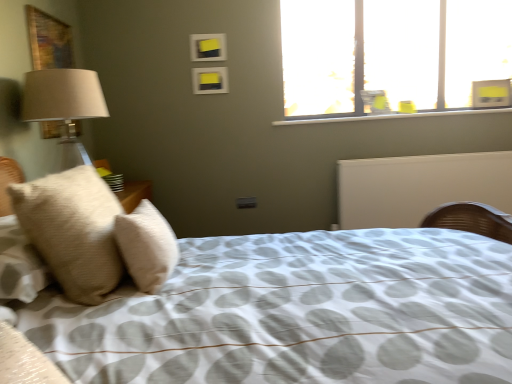
Question: Is yellow matte picture frame at upper center, which is the 2th picture frame in top-to-bottom order, next to white matte radiator at center?

Choices:
 (A) no
 (B) yes

Answer: (A)

Question: Is yellow matte picture frame at upper center, which is counted as the 1th picture frame, starting from the bottom, not inside white matte radiator at center?

Choices:
 (A) no
 (B) yes

Answer: (B)

Question: Does yellow matte picture frame at upper center, which is the 2th picture frame in top-to-bottom order, have a smaller size compared to white matte radiator at center?

Choices:
 (A) no
 (B) yes

Answer: (B)

Question: Is the depth of yellow matte picture frame at upper center, which is the 2th picture frame in top-to-bottom order, less than that of white matte radiator at center?

Choices:
 (A) no
 (B) yes

Answer: (B)

Question: From the image's perspective, would you say yellow matte picture frame at upper center, which is the 2th picture frame in top-to-bottom order, is shown under white matte radiator at center?

Choices:
 (A) no
 (B) yes

Answer: (A)

Question: Considering the positions of beige textured pillow at left, which is the 1th pillow from left to right, and transparent glass window at upper right in the image, is beige textured pillow at left, which is the 1th pillow from left to right, wider or thinner than transparent glass window at upper right?

Choices:
 (A) wide
 (B) thin

Answer: (A)

Question: Considering the positions of point (77, 276) and point (501, 67), is point (77, 276) closer or farther from the camera than point (501, 67)?

Choices:
 (A) farther
 (B) closer

Answer: (B)

Question: Considering the positions of beige textured pillow at left, which is the 1th pillow from left to right, and transparent glass window at upper right in the image, is beige textured pillow at left, which is the 1th pillow from left to right, taller or shorter than transparent glass window at upper right?

Choices:
 (A) short
 (B) tall

Answer: (A)

Question: From the image's perspective, relative to transparent glass window at upper right, is beige textured pillow at left, the 2th pillow positioned from the right, above or below?

Choices:
 (A) above
 (B) below

Answer: (B)

Question: Considering the positions of transparent glass window at upper right and white matte radiator at center in the image, is transparent glass window at upper right wider or thinner than white matte radiator at center?

Choices:
 (A) wide
 (B) thin

Answer: (B)

Question: Would you say transparent glass window at upper right is to the left or to the right of white matte radiator at center in the picture?

Choices:
 (A) right
 (B) left

Answer: (B)

Question: In terms of size, does transparent glass window at upper right appear bigger or smaller than white matte radiator at center?

Choices:
 (A) small
 (B) big

Answer: (A)

Question: Is transparent glass window at upper right inside the boundaries of white matte radiator at center, or outside?

Choices:
 (A) outside
 (B) inside

Answer: (A)

Question: Visually, is yellow matte picture frame at upper center, which is the 2th picture frame in top-to-bottom order, positioned to the left or to the right of transparent glass window at upper right?

Choices:
 (A) left
 (B) right

Answer: (A)

Question: Looking at their shapes, would you say yellow matte picture frame at upper center, which is counted as the 1th picture frame, starting from the bottom, is wider or thinner than transparent glass window at upper right?

Choices:
 (A) thin
 (B) wide

Answer: (A)